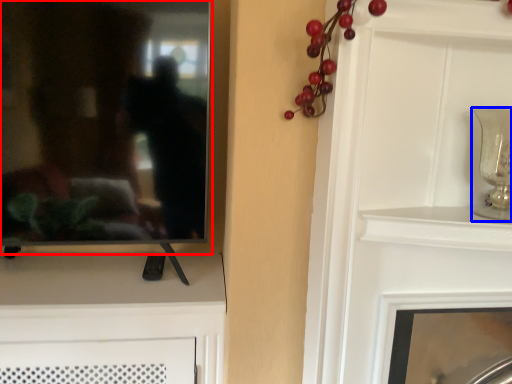
Question: Which object appears farthest to the camera in this image, mirror (highlighted by a red box) or candle holder (highlighted by a blue box)?

Choices:
 (A) mirror
 (B) candle holder

Answer: (A)